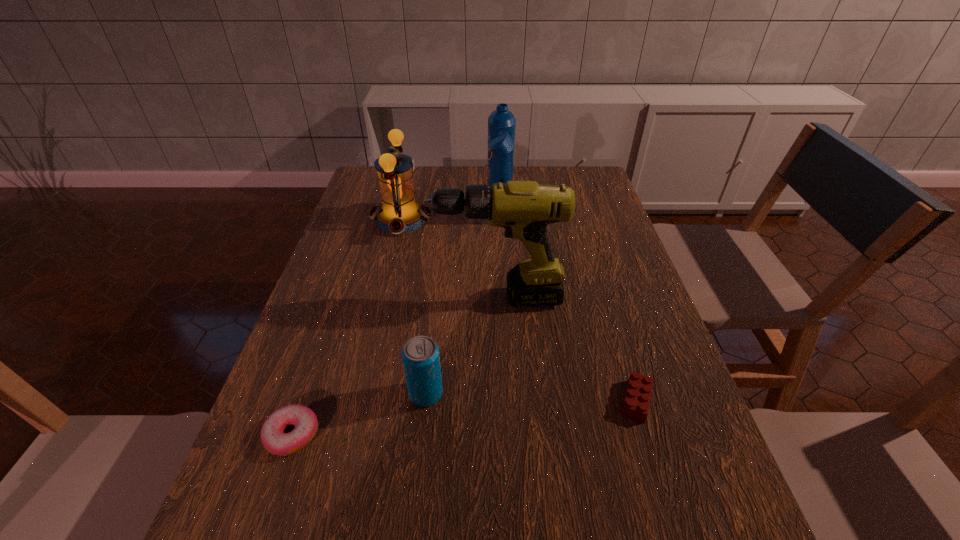
This screenshot has width=960, height=540. In order to click on vacant space that satisfies the following two spatial constraints: 1. on the handle side of the drill; 2. on the front side of the doughnut in this screenshot , I will do `click(503, 434)`.